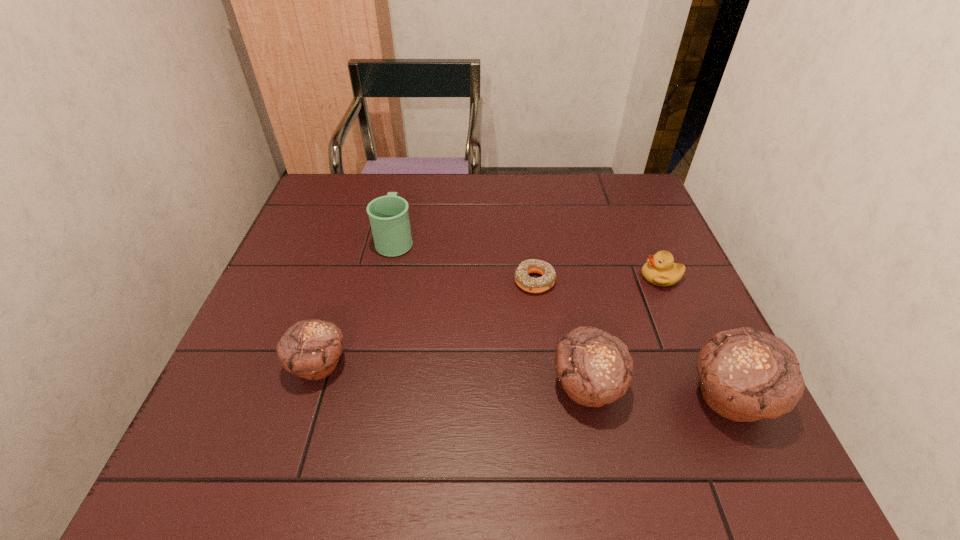
Choose which object is the second nearest neighbor to the rightmost muffin. Please provide its 2D coordinates. Your answer should be formatted as a tuple, i.e. [(x, y)], where the tuple contains the x and y coordinates of a point satisfying the conditions above.

[(660, 269)]

Find the location of a particular element. The image size is (960, 540). muffin that stands as the second closest to the rightmost muffin is located at coordinates (311, 349).

Point out which muffin is positioned as the third nearest to the second shortest object. Please provide its 2D coordinates. Your answer should be formatted as a tuple, i.e. [(x, y)], where the tuple contains the x and y coordinates of a point satisfying the conditions above.

[(311, 349)]

Where is `free spot that satisfies the following two spatial constraints: 1. on the front side of the doughnut; 2. on the right side of the second shortest muffin`? This screenshot has width=960, height=540. free spot that satisfies the following two spatial constraints: 1. on the front side of the doughnut; 2. on the right side of the second shortest muffin is located at coordinates (547, 386).

Locate an element on the screen. The width and height of the screenshot is (960, 540). free point that satisfies the following two spatial constraints: 1. on the front-facing side of the fifth tallest object; 2. on the back side of the rightmost muffin is located at coordinates (711, 397).

Where is `free spot that satisfies the following two spatial constraints: 1. on the front side of the shortest object; 2. on the left side of the second tallest muffin`? The height and width of the screenshot is (540, 960). free spot that satisfies the following two spatial constraints: 1. on the front side of the shortest object; 2. on the left side of the second tallest muffin is located at coordinates (547, 386).